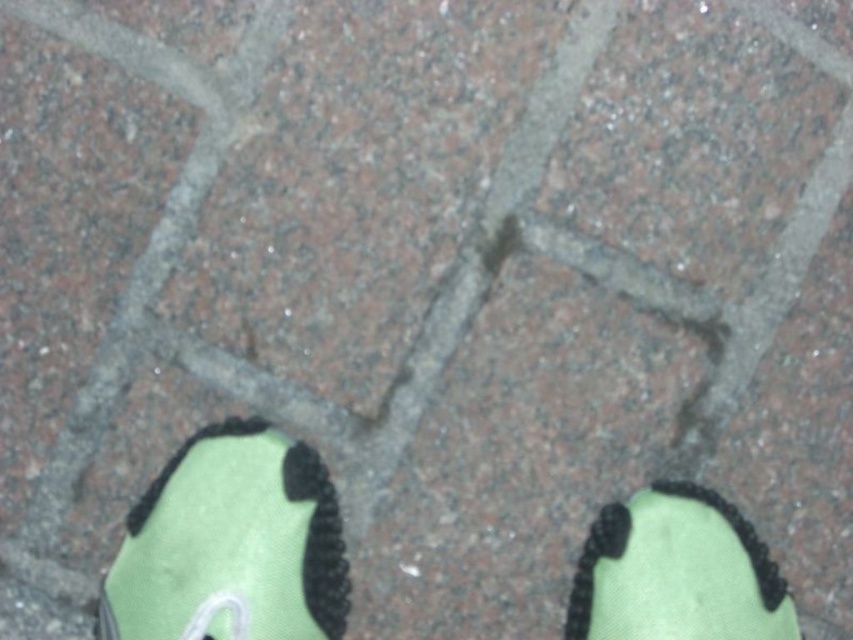
You are trying to take a photo of the textured brick surface but need to move the green fabric shoe at lower center and the green fabric shoe at lower right. Which shoe should you move first to ensure the other can be moved without obstruction?

The green fabric shoe at lower center is in front of the green fabric shoe at lower right. To move them without obstruction, you should move the green fabric shoe at lower center first, then the green fabric shoe at lower right.

You are a delivery robot that needs to place a small package between the green fabric shoe at lower center and the green fabric shoe at lower right. Can you fit the package if it measures 40 centimeters in length?

The distance between the green fabric shoe at lower center and the green fabric shoe at lower right is 44.05 centimeters. Since the package is 40 centimeters long, it can fit between them with some space to spare.